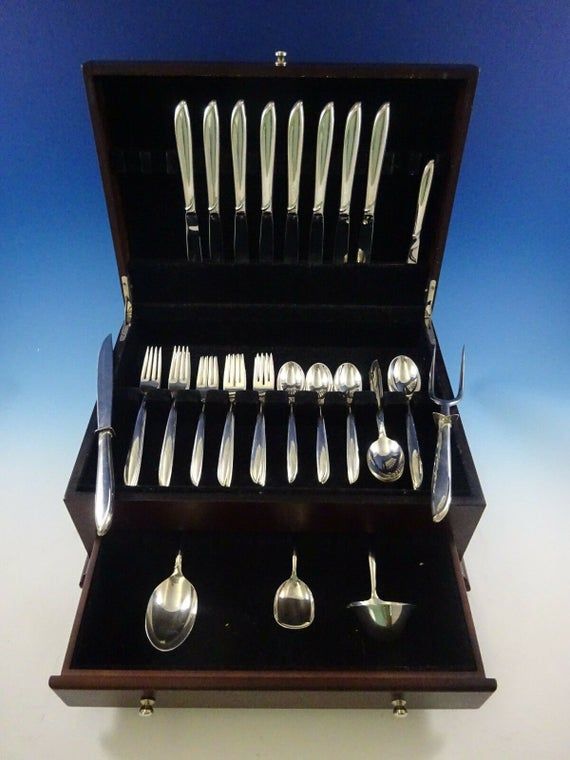
Where is `knives`? This screenshot has width=570, height=760. knives is located at coordinates (342, 207), (373, 182), (424, 197), (320, 198), (294, 184), (243, 185), (207, 181), (176, 160).